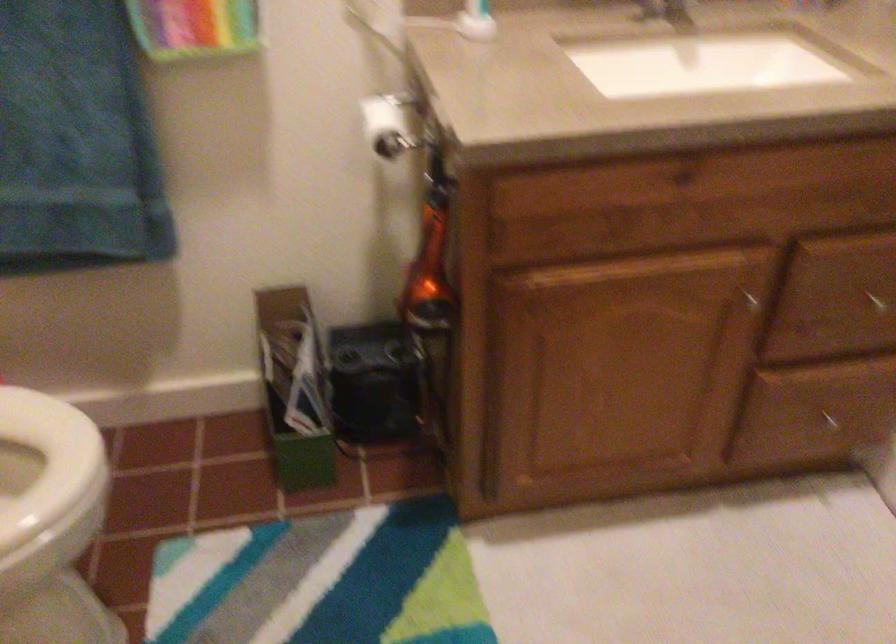
Find the location of a particular element. This screenshot has width=896, height=644. small cabinet handle is located at coordinates [875, 301].